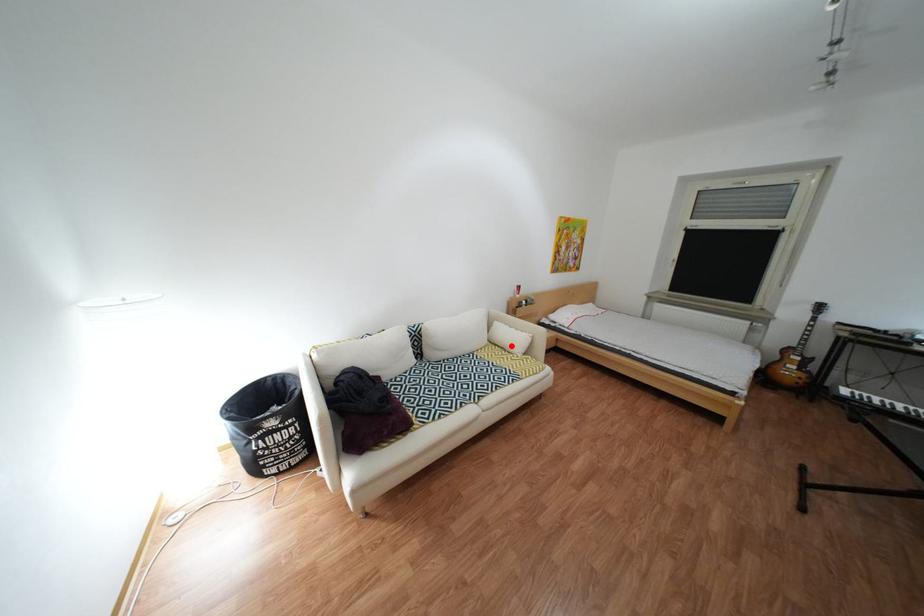
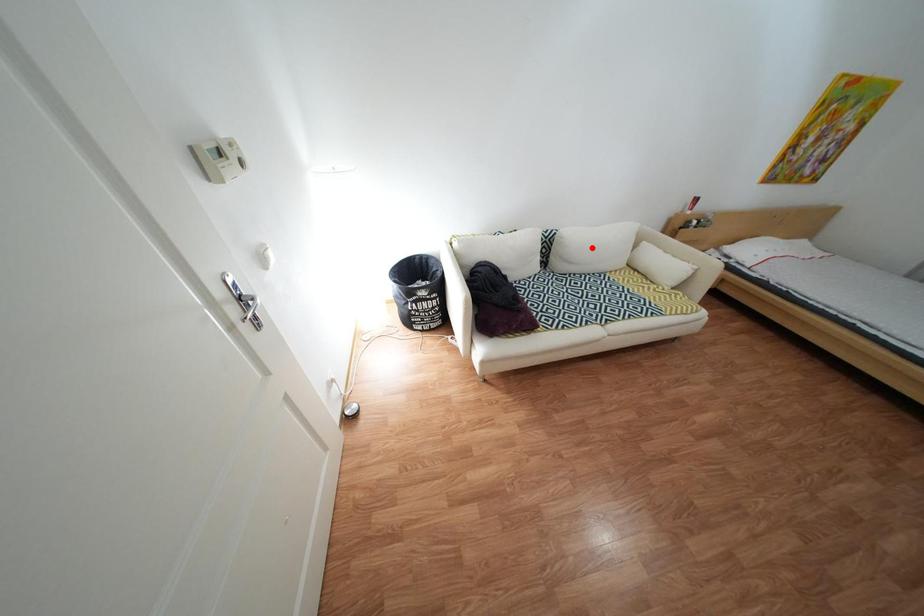
I am providing you with two images of the same scene from different viewpoints. A red point is marked on the first image and another point is marked on the second image. Is the red point in image1 aligned with the point shown in image2?

No